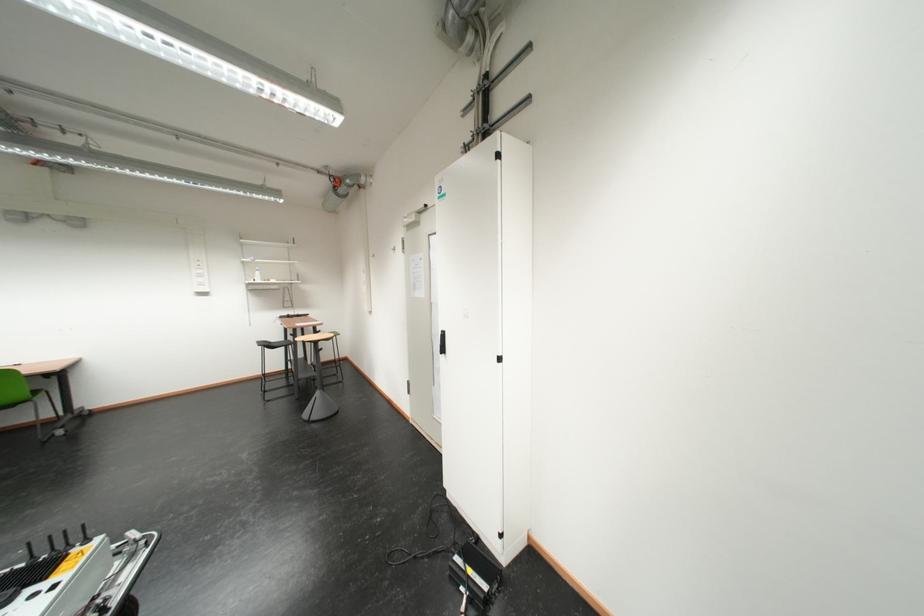
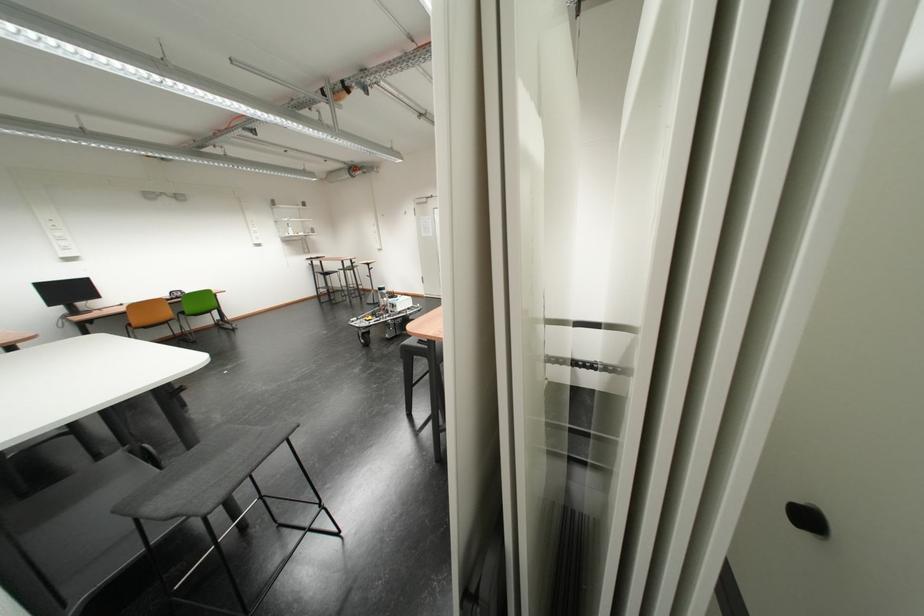
Looking at this image, in a continuous first-person perspective shot, in which direction is the camera moving?

The movement direction of the cameraman is left, backward.